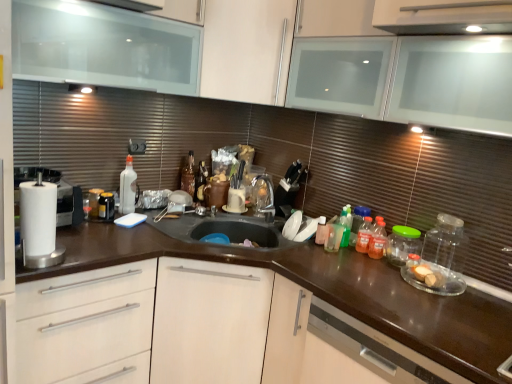
At what (x,y) coordinates should I click in order to perform the action: click on vacant area to the left of white glossy mug at center. Please return your answer as a coordinate pair (x, y). The height and width of the screenshot is (384, 512). Looking at the image, I should click on coord(202,206).